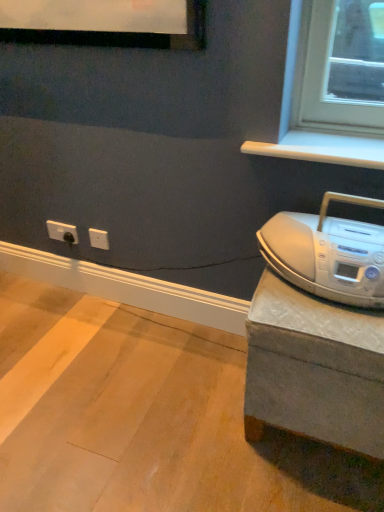
What do you see at coordinates (328, 253) in the screenshot? I see `silver metallic boombox at right` at bounding box center [328, 253].

This screenshot has width=384, height=512. I want to click on white plastic outlet at lower left, so click(62, 232).

Between silver metallic boombox at right and white plastic outlet at lower left, which one appears on the left side from the viewer's perspective?

Positioned to the left is white plastic outlet at lower left.

Is point (376, 249) positioned in front of point (69, 238)?

That is True.

Could you tell me if silver metallic boombox at right is turned towards white plastic outlet at lower left?

No, silver metallic boombox at right is not turned towards white plastic outlet at lower left.

This screenshot has width=384, height=512. I want to click on home appliance that is in front of the white plastic outlet at lower left, so click(x=328, y=253).

Looking at this image, who is taller, white plastic outlet at lower left or gray concrete at right?

white plastic outlet at lower left is taller.

From the picture: Could gray concrete at right be considered to be inside white plastic outlet at lower left?

That's incorrect, gray concrete at right is not inside white plastic outlet at lower left.

Which object is further away from the camera, white plastic outlet at lower left or gray concrete at right?

white plastic outlet at lower left.

You are a GUI agent. You are given a task and a screenshot of the screen. Output one action in this format:
    pyautogui.click(x=<x>, y=<y>)
    Task: Click on the electric outlet above the gray concrete at right (from a real-world perspective)
    This screenshot has height=512, width=384.
    Given the screenshot: What is the action you would take?
    pyautogui.click(x=62, y=232)

From the image's perspective, is silver metallic boombox at right above or below gray concrete at right?

silver metallic boombox at right is situated higher than gray concrete at right in the image.

Is silver metallic boombox at right in contact with gray concrete at right?

No, silver metallic boombox at right is not in contact with gray concrete at right.

How different are the orientations of silver metallic boombox at right and gray concrete at right in degrees?

89.6 degrees separate the facing orientations of silver metallic boombox at right and gray concrete at right.

Is silver metallic boombox at right thinner than gray concrete at right?

Correct, the width of silver metallic boombox at right is less than that of gray concrete at right.

Does point (177, 385) come farther from viewer compared to point (75, 226)?

That is False.

What's the angular difference between gray concrete at right and white plastic outlet at lower left's facing directions?

There is a 89.1-degree angle between the facing directions of gray concrete at right and white plastic outlet at lower left.

From the image's perspective, is gray concrete at right located above or below white plastic outlet at lower left?

gray concrete at right is below white plastic outlet at lower left.

In the scene shown: Is gray concrete at right positioned beyond the bounds of white plastic outlet at lower left?

Yes.

Considering the relative sizes of gray concrete at right and silver metallic boombox at right in the image provided, is gray concrete at right shorter than silver metallic boombox at right?

Yes, gray concrete at right is shorter than silver metallic boombox at right.

Based on their sizes in the image, would you say gray concrete at right is bigger or smaller than silver metallic boombox at right?

gray concrete at right is bigger than silver metallic boombox at right.

From the picture: From the image's perspective, between gray concrete at right and silver metallic boombox at right, who is located below?

From the image's view, gray concrete at right is below.

Is white plastic outlet at lower left oriented away from silver metallic boombox at right?

No, white plastic outlet at lower left is not facing the opposite direction of silver metallic boombox at right.

Considering the points (68, 224) and (329, 259), which point is in front, point (68, 224) or point (329, 259)?

The point (329, 259) is in front.

Is white plastic outlet at lower left further to camera compared to silver metallic boombox at right?

That is True.

Can you tell me how much white plastic outlet at lower left and silver metallic boombox at right differ in facing direction?

0.507 degrees.

The image size is (384, 512). In order to click on electric outlet that is on the left side of silver metallic boombox at right in this screenshot , I will do `click(62, 232)`.

Find the location of a particular element. The width and height of the screenshot is (384, 512). concrete directly beneath the white plastic outlet at lower left (from a real-world perspective) is located at coordinates (145, 417).

Based on their spatial positions, is gray concrete at right or silver metallic boombox at right further from white plastic outlet at lower left?

The object further to white plastic outlet at lower left is silver metallic boombox at right.

Considering their positions, is silver metallic boombox at right positioned further to white plastic outlet at lower left than gray concrete at right?

silver metallic boombox at right is further to white plastic outlet at lower left.

Which object lies further to the anchor point gray concrete at right, white plastic outlet at lower left or silver metallic boombox at right?

Among the two, white plastic outlet at lower left is located further to gray concrete at right.

Considering their positions, is gray concrete at right positioned further to silver metallic boombox at right than white plastic outlet at lower left?

Among the two, white plastic outlet at lower left is located further to silver metallic boombox at right.

Estimate the real-world distances between objects in this image. Which object is further from gray concrete at right, silver metallic boombox at right or white plastic outlet at lower left?

white plastic outlet at lower left is further to gray concrete at right.

Looking at this image, when comparing their distances from silver metallic boombox at right, does white plastic outlet at lower left or gray concrete at right seem closer?

The object closer to silver metallic boombox at right is gray concrete at right.

Locate an element on the screen. The image size is (384, 512). home appliance between gray concrete at right and white plastic outlet at lower left along the z-axis is located at coordinates point(328,253).